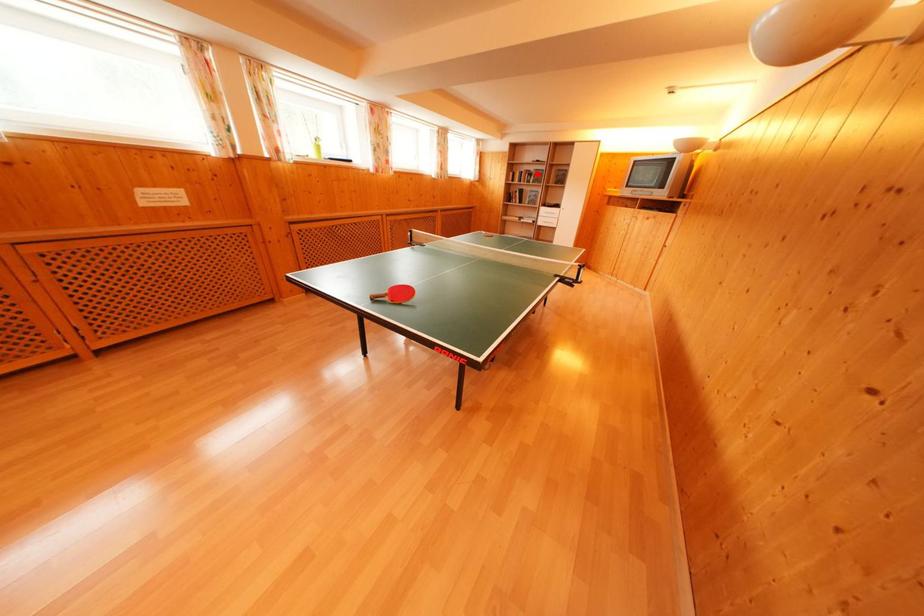
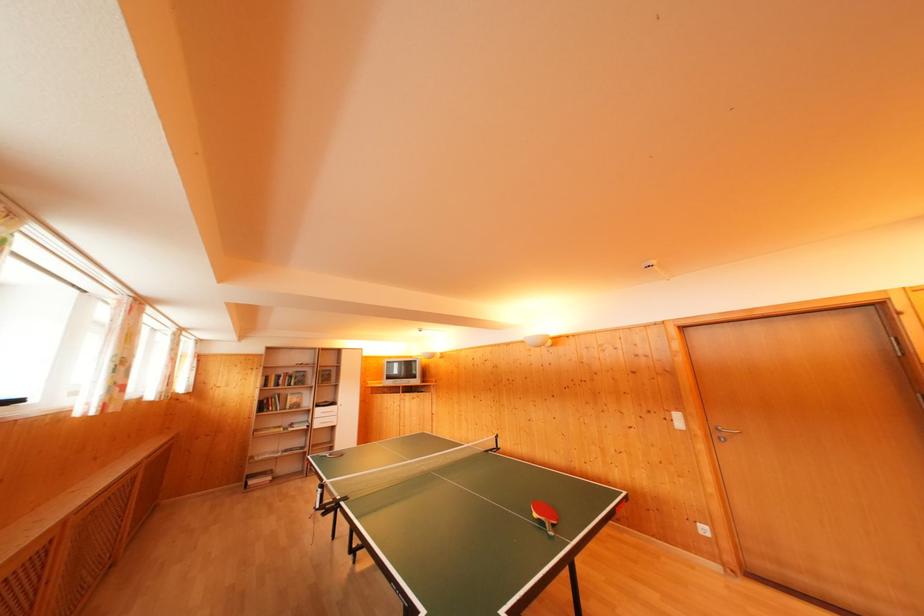
Find the pixel in the second image that matches the highlighted location in the first image.

(296, 376)